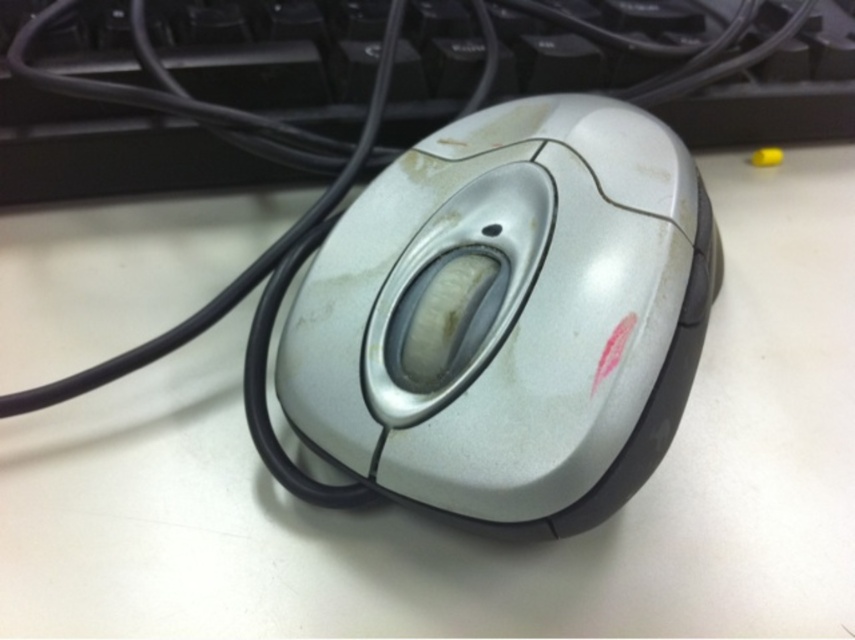
Question: Is slightly worn silver mouse at center wider than black plastic keyboard at upper center?

Choices:
 (A) no
 (B) yes

Answer: (A)

Question: Is slightly worn silver mouse at center positioned before black plastic keyboard at upper center?

Choices:
 (A) yes
 (B) no

Answer: (A)

Question: Which object appears farthest from the camera in this image?

Choices:
 (A) black plastic keyboard at upper center
 (B) slightly worn silver mouse at center

Answer: (A)

Question: Which object appears farthest from the camera in this image?

Choices:
 (A) black plastic keyboard at upper center
 (B) slightly worn silver mouse at center

Answer: (A)

Question: Which object appears farthest from the camera in this image?

Choices:
 (A) slightly worn silver mouse at center
 (B) black plastic keyboard at upper center

Answer: (B)

Question: Is slightly worn silver mouse at center thinner than black plastic keyboard at upper center?

Choices:
 (A) yes
 (B) no

Answer: (A)